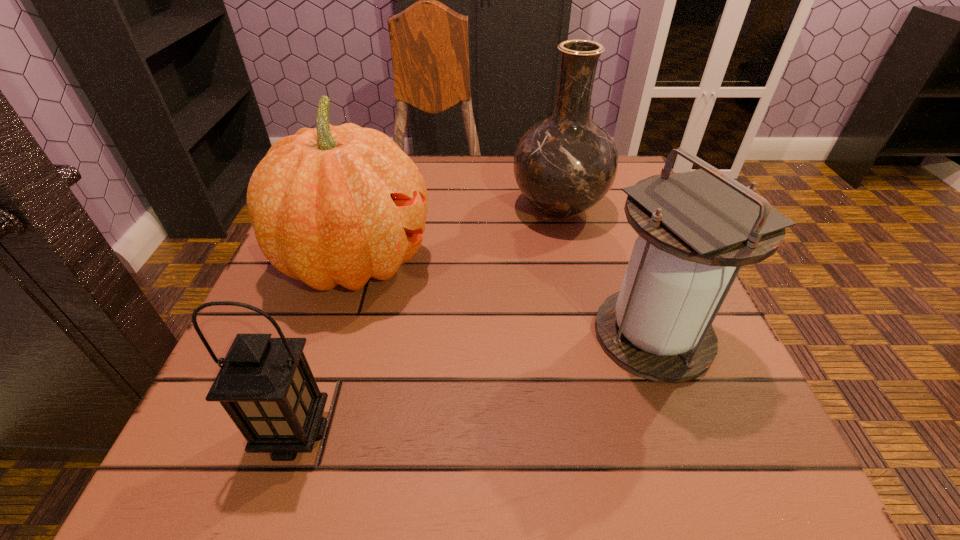
Locate an element on the screen. vase is located at coordinates (565, 164).

Locate an element on the screen. pumpkin is located at coordinates (332, 205).

At what (x,y) coordinates should I click in order to perform the action: click on the farther lantern. Please return your answer as a coordinate pair (x, y). The height and width of the screenshot is (540, 960). Looking at the image, I should click on (696, 229).

I want to click on the shorter lantern, so click(266, 386).

Find the location of a particular element. The image size is (960, 540). the nearest object is located at coordinates (266, 386).

At what (x,y) coordinates should I click in order to perform the action: click on free space located 0.070m on the left of the vase. Please return your answer as a coordinate pair (x, y). This screenshot has height=540, width=960. Looking at the image, I should click on (479, 207).

This screenshot has width=960, height=540. I want to click on vacant space situated 0.240m on the carved face of the pumpkin, so click(560, 261).

Locate an element on the screen. vacant space located 0.340m on the back of the right lantern is located at coordinates (599, 188).

In order to click on free space located 0.080m on the left of the shorter lantern in this screenshot , I will do `click(200, 433)`.

In order to click on object situated at the far edge in this screenshot , I will do `click(565, 164)`.